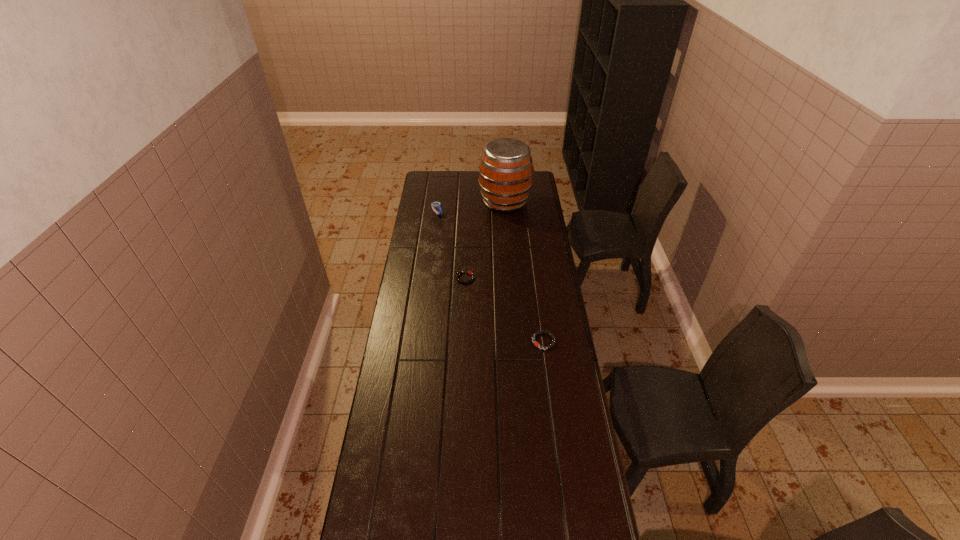
Identify the location of free area in between the watch and the nearer bracelet. (x=491, y=277).

The image size is (960, 540). Identify the location of vacant point located between the nearest object and the leftmost object. (491, 277).

Where is `vacant space that is in between the third shortest object and the cider`? Image resolution: width=960 pixels, height=540 pixels. vacant space that is in between the third shortest object and the cider is located at coordinates pyautogui.click(x=470, y=207).

The height and width of the screenshot is (540, 960). I want to click on free space between the nearer bracelet and the tallest object, so click(x=524, y=271).

At what (x,y) coordinates should I click in order to perform the action: click on free spot between the second object from left to right and the nearest object. Please return your answer as a coordinate pair (x, y). The image size is (960, 540). Looking at the image, I should click on (505, 309).

I want to click on vacant area that lies between the tallest object and the watch, so click(470, 207).

Find the location of a particular element. This screenshot has width=960, height=540. unoccupied area between the farther bracelet and the leftmost object is located at coordinates (451, 245).

Find the location of `free space between the tallest object and the second tallest object`. free space between the tallest object and the second tallest object is located at coordinates coord(470,207).

At what (x,y) coordinates should I click in order to perform the action: click on object that stands as the closest to the left bracelet. Please return your answer as a coordinate pair (x, y). Looking at the image, I should click on (536, 333).

Select which object is the second closest to the tallest object. Please provide its 2D coordinates. Your answer should be formatted as a tuple, i.e. [(x, y)], where the tuple contains the x and y coordinates of a point satisfying the conditions above.

[(469, 272)]